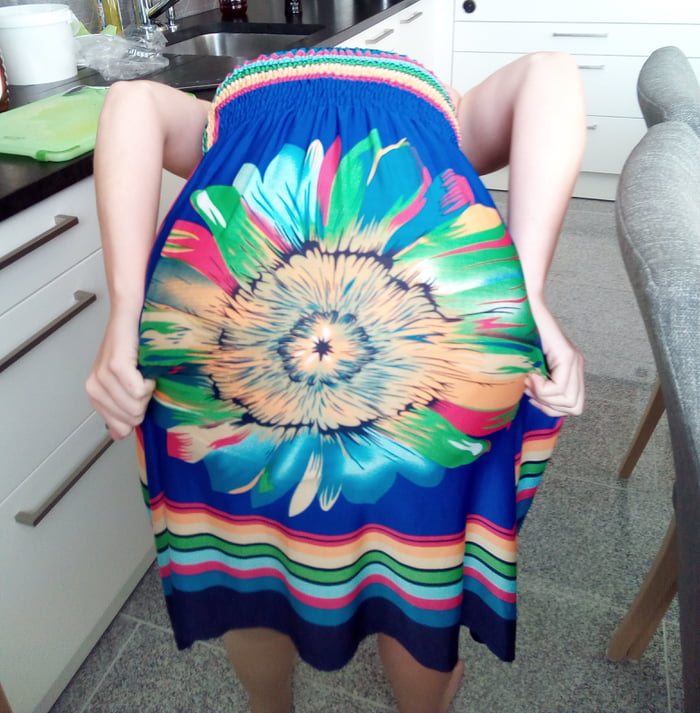
Where is `fabric`? The image size is (700, 713). fabric is located at coordinates (355, 376).